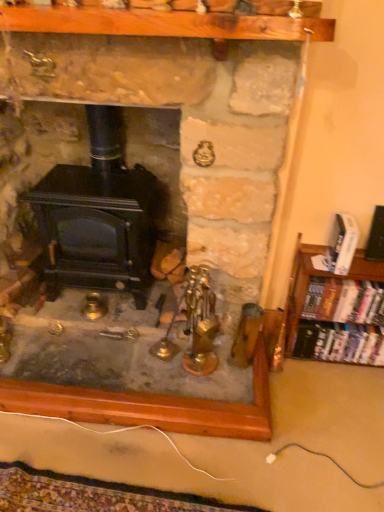
Question: Considering the relative sizes of white glossy book at right, the third book from the bottom, and hardcover books at right, which appears as the 2th book when ordered from the bottom, in the image provided, is white glossy book at right, the third book from the bottom, wider than hardcover books at right, which appears as the 2th book when ordered from the bottom,?

Choices:
 (A) yes
 (B) no

Answer: (A)

Question: Is white glossy book at right, acting as the 1th book starting from the top, closer to camera compared to hardcover books at right, the 2th book in the top-to-bottom sequence?

Choices:
 (A) yes
 (B) no

Answer: (A)

Question: From the image's perspective, is white glossy book at right, the third book from the bottom, over hardcover books at right, the 2th book in the top-to-bottom sequence?

Choices:
 (A) yes
 (B) no

Answer: (A)

Question: Considering the relative sizes of white glossy book at right, the third book from the bottom, and hardcover books at right, which appears as the 2th book when ordered from the bottom, in the image provided, is white glossy book at right, the third book from the bottom, smaller than hardcover books at right, which appears as the 2th book when ordered from the bottom,?

Choices:
 (A) no
 (B) yes

Answer: (B)

Question: Could you tell me if white glossy book at right, the third book from the bottom, is facing hardcover books at right, which appears as the 2th book when ordered from the bottom?

Choices:
 (A) yes
 (B) no

Answer: (B)

Question: Relative to black matte wood burning stove at center, is white glossy book at right, acting as the 1th book starting from the top, in front or behind?

Choices:
 (A) behind
 (B) front

Answer: (B)

Question: Is white glossy book at right, acting as the 1th book starting from the top, to the left or to the right of black matte wood burning stove at center in the image?

Choices:
 (A) left
 (B) right

Answer: (B)

Question: Is white glossy book at right, the third book from the bottom, taller or shorter than black matte wood burning stove at center?

Choices:
 (A) tall
 (B) short

Answer: (B)

Question: From a real-world perspective, is white glossy book at right, the third book from the bottom, above or below black matte wood burning stove at center?

Choices:
 (A) above
 (B) below

Answer: (A)

Question: Relative to hardcover books at right, the 1th book in the bottom-to-top sequence, is black matte wood burning stove at center in front or behind?

Choices:
 (A) front
 (B) behind

Answer: (A)

Question: Considering the positions of black matte wood burning stove at center and hardcover books at right, the 1th book in the bottom-to-top sequence, in the image, is black matte wood burning stove at center taller or shorter than hardcover books at right, the 1th book in the bottom-to-top sequence,?

Choices:
 (A) short
 (B) tall

Answer: (B)

Question: From the image's perspective, is black matte wood burning stove at center located above or below hardcover books at right, which ranks as the third book in top-to-bottom order?

Choices:
 (A) above
 (B) below

Answer: (A)

Question: Considering the relative positions of black matte wood burning stove at center and hardcover books at right, which ranks as the third book in top-to-bottom order, in the image provided, is black matte wood burning stove at center to the left or to the right of hardcover books at right, which ranks as the third book in top-to-bottom order,?

Choices:
 (A) left
 (B) right

Answer: (A)

Question: Is black matte wood burning stove at center inside or outside of white glossy book at right, acting as the 1th book starting from the top?

Choices:
 (A) inside
 (B) outside

Answer: (B)

Question: Considering the positions of black matte wood burning stove at center and white glossy book at right, the third book from the bottom, in the image, is black matte wood burning stove at center wider or thinner than white glossy book at right, the third book from the bottom,?

Choices:
 (A) thin
 (B) wide

Answer: (B)